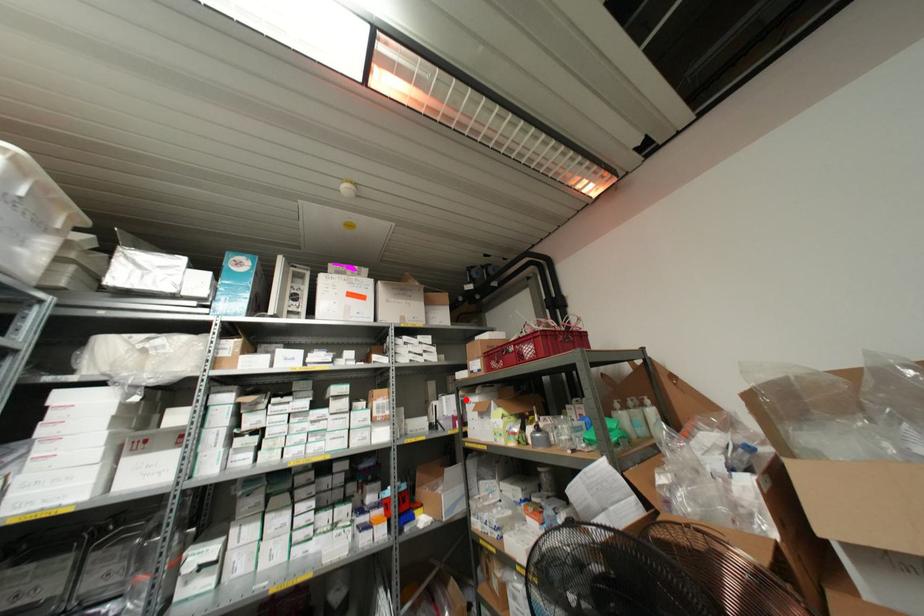
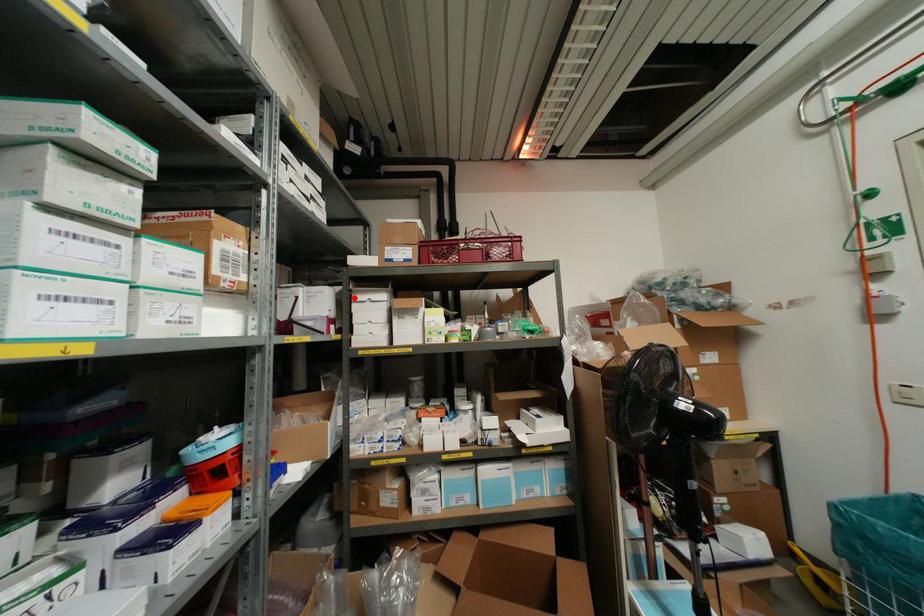
I am providing you with two images of the same scene from different viewpoints. A red point is marked on the first image and another point is marked on the second image. Does the point marked in image1 correspond to the same location as the one in image2?

Yes